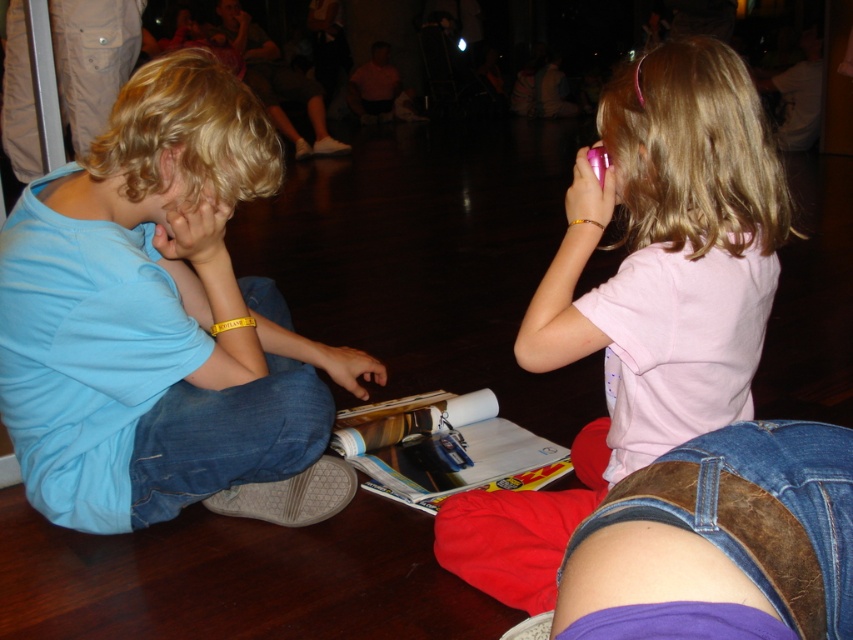
Does matte blue shirt at left have a smaller size compared to pink matte phone at upper right?

Actually, matte blue shirt at left might be larger than pink matte phone at upper right.

In the scene shown: Which of these two, matte blue shirt at left or pink matte phone at upper right, stands taller?

Standing taller between the two is matte blue shirt at left.

Is point (10, 218) positioned in front of point (730, 72)?

No, it is not.

You are a GUI agent. You are given a task and a screenshot of the screen. Output one action in this format:
    pyautogui.click(x=<x>, y=<y>)
    Task: Click on the matte blue shirt at left
    
    Given the screenshot: What is the action you would take?
    pyautogui.click(x=163, y=324)

Who is more distant from viewer, (x=321, y=435) or (x=744, y=492)?

The point (x=321, y=435) is more distant.

Is point (163, 416) positioned after point (846, 625)?

Yes, it is behind point (846, 625).

Where is `matte blue shirt at left`? matte blue shirt at left is located at coordinates [163, 324].

Is pink matte phone at upper right taller than brown leather belt at lower right?

Yes, pink matte phone at upper right is taller than brown leather belt at lower right.

Is pink matte phone at upper right wider than brown leather belt at lower right?

Yes.

What do you see at coordinates (643, 301) in the screenshot? I see `pink matte phone at upper right` at bounding box center [643, 301].

Where is `pink matte phone at upper right`? pink matte phone at upper right is located at coordinates (643, 301).